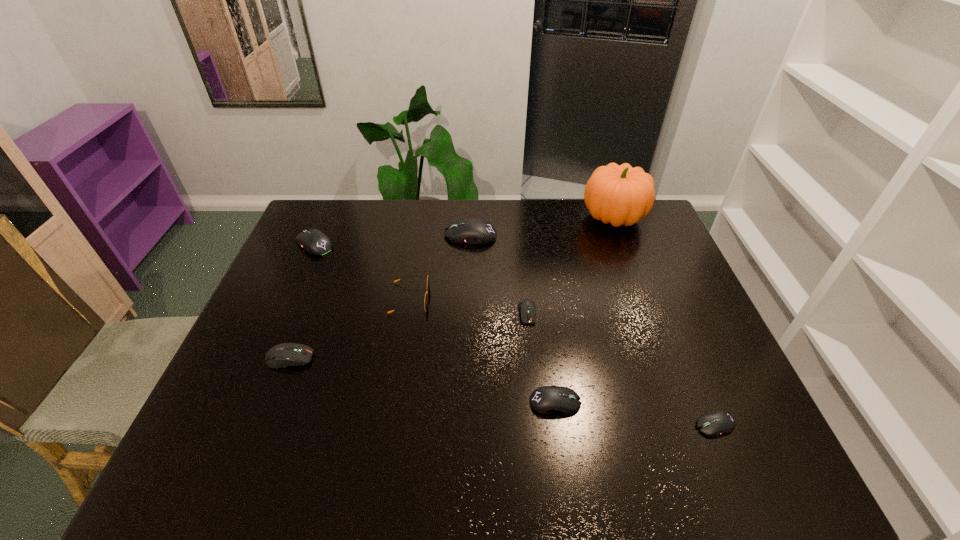
You are a GUI agent. You are given a task and a screenshot of the screen. Output one action in this format:
    pyautogui.click(x=<x>, y=<y>)
    Task: Click on the vacant space in between the bigger dark computer equipment and the sunglasses
    
    Given the screenshot: What is the action you would take?
    pyautogui.click(x=349, y=328)

I want to click on empty space between the leftmost black computer equipment and the right dark computer equipment, so click(x=420, y=279).

I want to click on object that stands as the third closest to the rightmost black computer equipment, so click(620, 195).

This screenshot has width=960, height=540. I want to click on object that is the fourth nearest to the sunglasses, so click(x=315, y=242).

Select which computer equipment is the second closest to the leftmost black computer equipment. Please provide its 2D coordinates. Your answer should be formatted as a tuple, i.e. [(x, y)], where the tuple contains the x and y coordinates of a point satisfying the conditions above.

[(282, 355)]

Identify which computer equipment is the fifth nearest to the third computer equipment from left to right. Please provide its 2D coordinates. Your answer should be formatted as a tuple, i.e. [(x, y)], where the tuple contains the x and y coordinates of a point satisfying the conditions above.

[(715, 423)]

This screenshot has width=960, height=540. Identify the location of black computer equipment that is the third closest one to the leftmost black computer equipment. pyautogui.click(x=715, y=423).

The height and width of the screenshot is (540, 960). I want to click on the second closest black computer equipment to the third black computer equipment from right to left, so click(547, 399).

Locate an element on the screen. The width and height of the screenshot is (960, 540). blank area in the image that satisfies the following two spatial constraints: 1. on the button of the smallest black computer equipment; 2. on the left side of the third farthest computer equipment is located at coordinates (540, 425).

At what (x,y) coordinates should I click in order to perform the action: click on free location that satisfies the following two spatial constraints: 1. on the front side of the second black computer equipment from right to left; 2. on the left side of the tallest computer equipment. Please return your answer as a coordinate pair (x, y). This screenshot has width=960, height=540. Looking at the image, I should click on (466, 402).